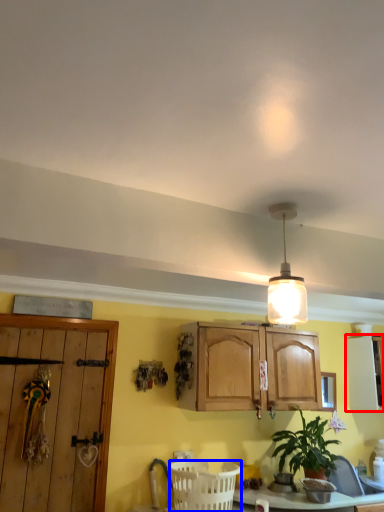
Question: Which of the following is the closest to the observer, cabinetry (highlighted by a red box) or basket (highlighted by a blue box)?

Choices:
 (A) cabinetry
 (B) basket

Answer: (B)